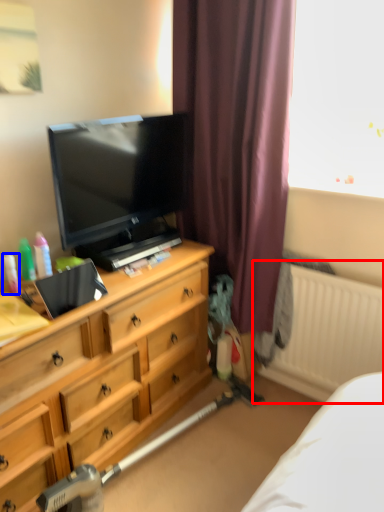
Question: Which point is closer to the camera, radiator (highlighted by a red box) or toiletry (highlighted by a blue box)?

Choices:
 (A) radiator
 (B) toiletry

Answer: (B)